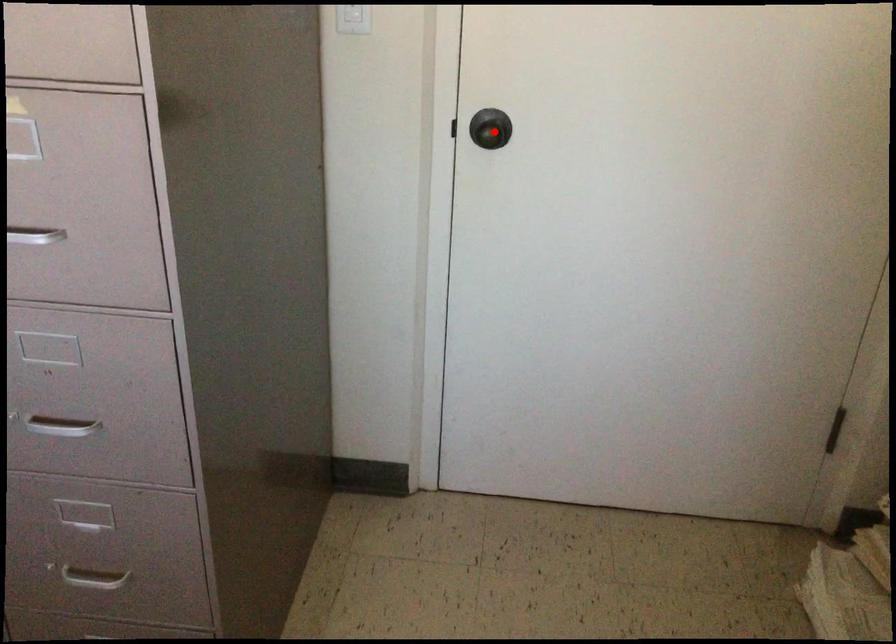
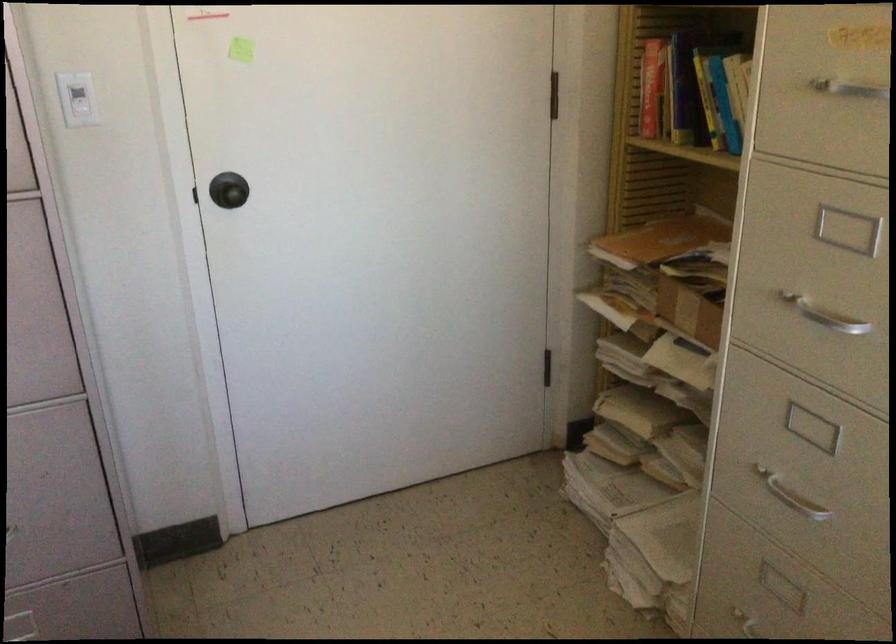
Find the pixel in the second image that matches the highlighted location in the first image.

(228, 190)